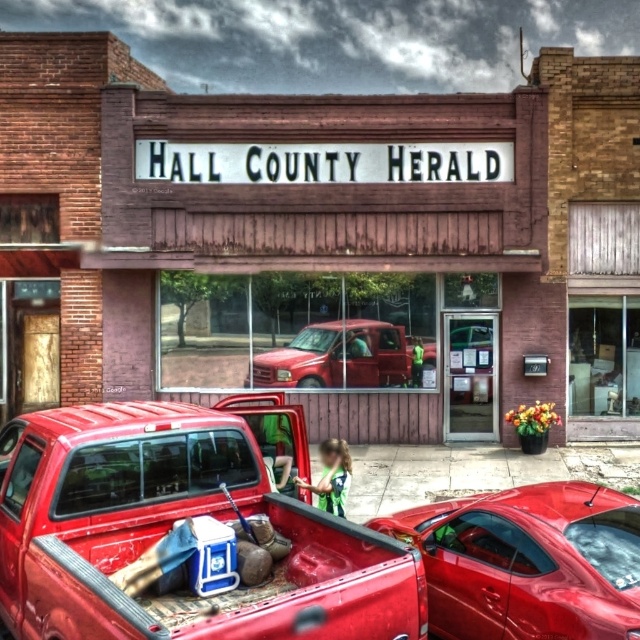
Question: Which object is the farthest from the wooden signboard at center?

Choices:
 (A) metallic red pickup truck at center
 (B) matte red truck at center

Answer: (A)

Question: Which point is closer to the camera taking this photo?

Choices:
 (A) (29, 577)
 (B) (131, 365)

Answer: (A)

Question: Can you confirm if wooden signboard at center is positioned to the left of metallic red pickup truck at center?

Choices:
 (A) no
 (B) yes

Answer: (A)

Question: Can you confirm if glossy red car at center is positioned to the left of matte red truck at center?

Choices:
 (A) yes
 (B) no

Answer: (B)

Question: Which of the following is the closest to the observer?

Choices:
 (A) matte red truck at center
 (B) wooden signboard at center
 (C) glossy red car at center

Answer: (C)

Question: Where is wooden signboard at center located in relation to matte red truck at center in the image?

Choices:
 (A) right
 (B) left

Answer: (A)